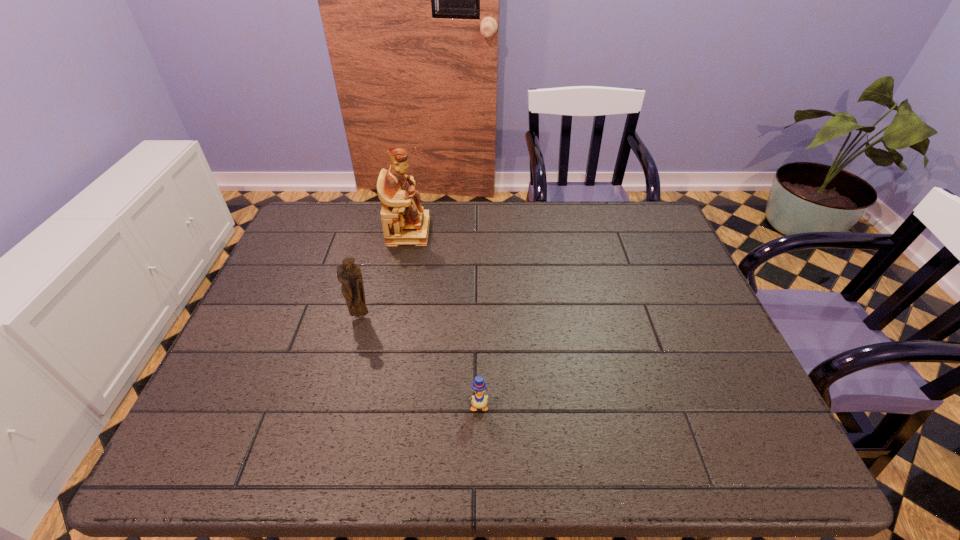
I want to click on vacant area at the far edge, so click(568, 236).

Locate an element on the screen. The image size is (960, 540). vacant region at the near edge of the desktop is located at coordinates [469, 442].

You are a GUI agent. You are given a task and a screenshot of the screen. Output one action in this format:
    pyautogui.click(x=<x>, y=<y>)
    Task: Click on the free space at the left edge of the desktop
    This screenshot has height=540, width=960.
    Given the screenshot: What is the action you would take?
    pyautogui.click(x=262, y=326)

Locate an element on the screen. The height and width of the screenshot is (540, 960). vacant area at the right edge of the desktop is located at coordinates (677, 396).

I want to click on vacant area at the far left corner, so click(x=328, y=223).

Identify the location of vacant area at the far right corner of the desktop. (630, 224).

This screenshot has width=960, height=540. I want to click on vacant space at the near right corner of the desktop, so click(x=764, y=463).

I want to click on free space between the second farthest object and the rightmost object, so click(420, 361).

Locate an element on the screen. This screenshot has width=960, height=540. free space between the duckling and the farthest object is located at coordinates (444, 319).

Where is `vacant area that lies between the taller figurine and the shortest object`? vacant area that lies between the taller figurine and the shortest object is located at coordinates (444, 319).